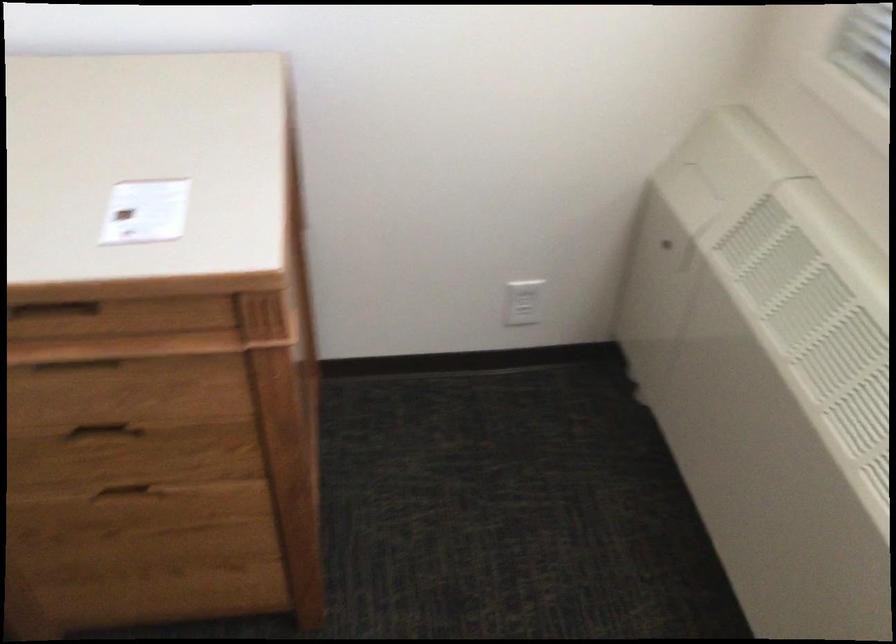
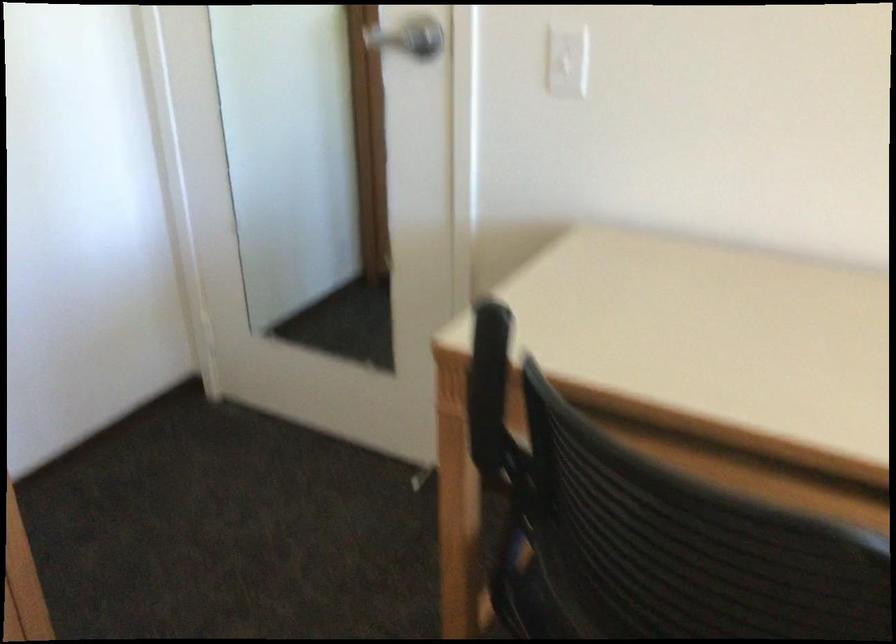
Question: The images are taken continuously from a first-person perspective. In which direction is your viewpoint rotating?

Choices:
 (A) Left
 (B) Right
 (C) Up
 (D) Down

Answer: (A)